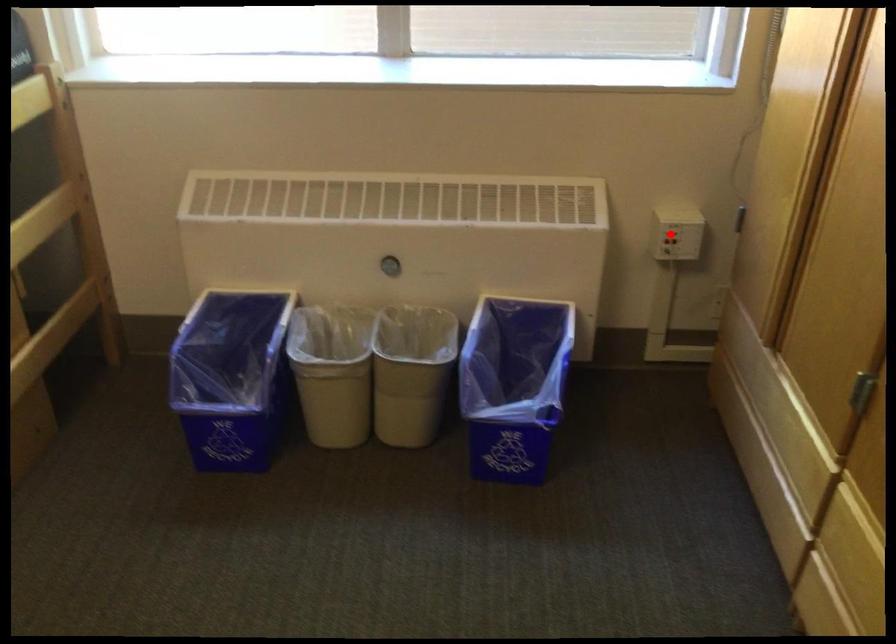
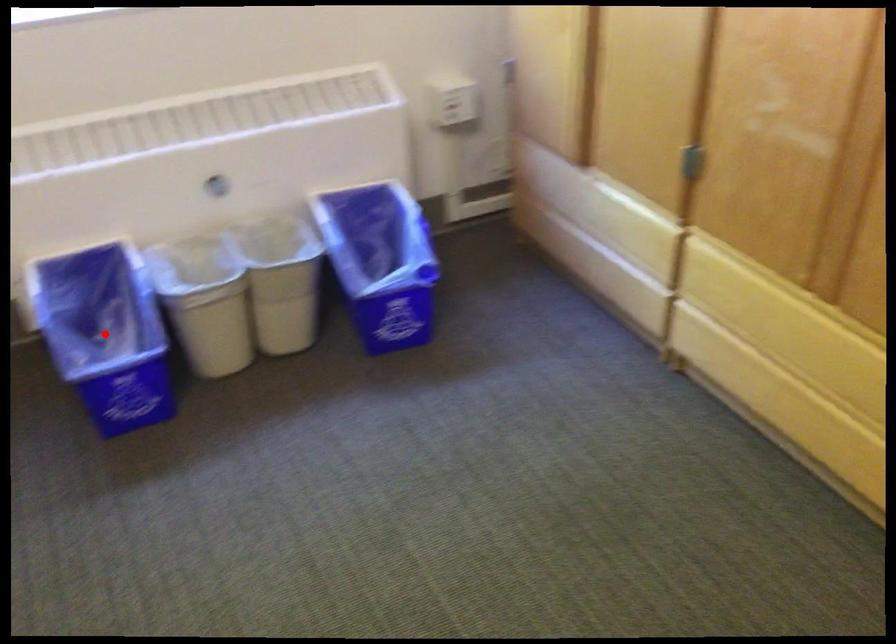
I am providing you with two images of the same scene from different viewpoints. A red point is marked on the first image and another point is marked on the second image. Are the points marked in image1 and image2 representing the same 3D position?

No